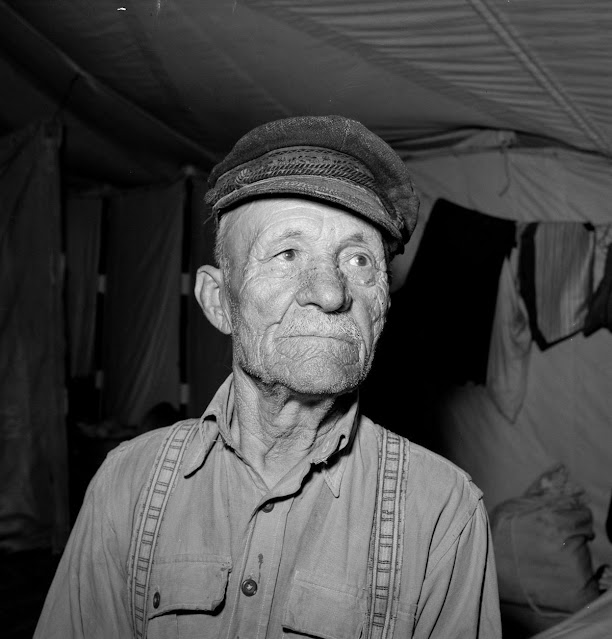
Locate an element on the screen. black and white rectangular photograph is located at coordinates (13, 8).